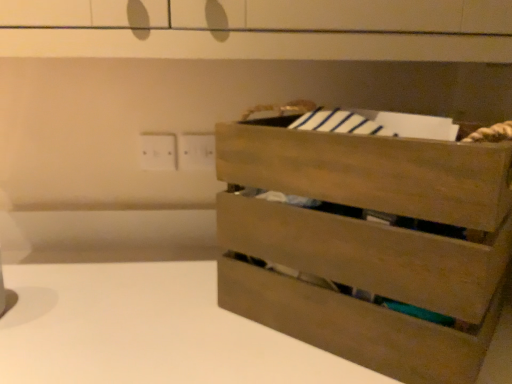
Question: Can you confirm if natural wood crate at right is wider than white plastic electric outlet at upper left?

Choices:
 (A) yes
 (B) no

Answer: (A)

Question: Is natural wood crate at right behind white plastic electric outlet at upper left?

Choices:
 (A) no
 (B) yes

Answer: (A)

Question: Considering the relative sizes of natural wood crate at right and white plastic electric outlet at upper left in the image provided, is natural wood crate at right thinner than white plastic electric outlet at upper left?

Choices:
 (A) no
 (B) yes

Answer: (A)

Question: From a real-world perspective, does natural wood crate at right sit lower than white plastic electric outlet at upper left?

Choices:
 (A) no
 (B) yes

Answer: (B)

Question: Are natural wood crate at right and white plastic electric outlet at upper left far apart?

Choices:
 (A) yes
 (B) no

Answer: (B)

Question: From the image's perspective, is natural wood crate at right above white plastic electric outlet at upper left?

Choices:
 (A) yes
 (B) no

Answer: (B)

Question: Considering the relative sizes of white plastic electric outlet at upper left and natural wood crate at right in the image provided, is white plastic electric outlet at upper left smaller than natural wood crate at right?

Choices:
 (A) yes
 (B) no

Answer: (A)

Question: Is white plastic electric outlet at upper left thinner than natural wood crate at right?

Choices:
 (A) yes
 (B) no

Answer: (A)

Question: Does white plastic electric outlet at upper left touch natural wood crate at right?

Choices:
 (A) yes
 (B) no

Answer: (B)

Question: From the image's perspective, is white plastic electric outlet at upper left located beneath natural wood crate at right?

Choices:
 (A) yes
 (B) no

Answer: (B)

Question: Is white plastic electric outlet at upper left positioned behind natural wood crate at right?

Choices:
 (A) yes
 (B) no

Answer: (A)

Question: From a real-world perspective, is white plastic electric outlet at upper left on natural wood crate at right?

Choices:
 (A) no
 (B) yes

Answer: (B)

Question: From the image's perspective, relative to natural wood crate at right, is white plastic electric outlet at upper left above or below?

Choices:
 (A) below
 (B) above

Answer: (B)